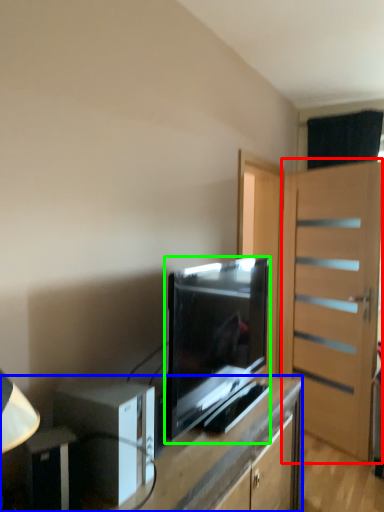
Question: Based on their relative distances, which object is nearer to door (highlighted by a red box)? Choose from desk (highlighted by a blue box) and television (highlighted by a green box).

Choices:
 (A) desk
 (B) television

Answer: (B)